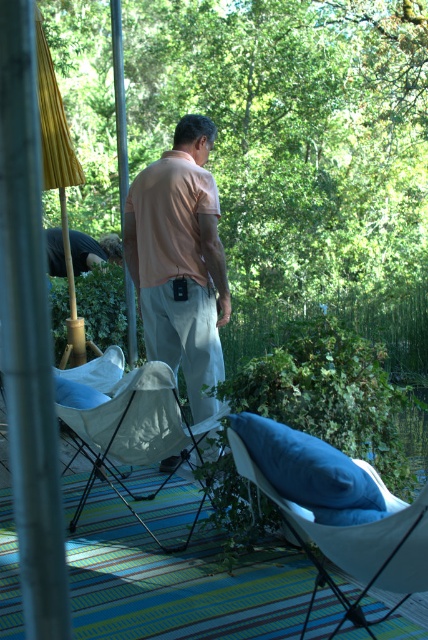
Question: Which object appears closest to the camera in this image?

Choices:
 (A) velvet blue cushion at lower right
 (B) metallic pole at upper center
 (C) matte khaki pants at center

Answer: (A)

Question: Is matte khaki pants at center to the left of white fabric chair at center from the viewer's perspective?

Choices:
 (A) no
 (B) yes

Answer: (A)

Question: Which point is closer to the camera?

Choices:
 (A) silver metallic pole at left
 (B) dark brown leather jacket at lower left
 (C) matte khaki pants at center
 (D) velvet blue cushion at lower right

Answer: (A)

Question: In this image, where is silver metallic pole at left located relative to metallic pole at upper center?

Choices:
 (A) right
 (B) left

Answer: (A)

Question: Does silver metallic pole at left appear under velvet blue cushion at lower right?

Choices:
 (A) yes
 (B) no

Answer: (B)

Question: Which point is farther to the camera?

Choices:
 (A) blue soft pillow at lower center
 (B) metallic pole at upper center

Answer: (B)